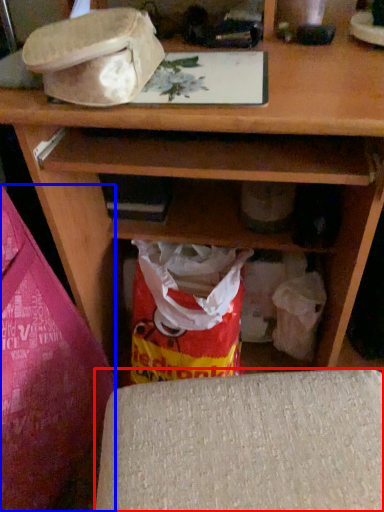
Question: Which object is further to the camera taking this photo, furniture (highlighted by a red box) or leftover (highlighted by a blue box)?

Choices:
 (A) furniture
 (B) leftover

Answer: (A)